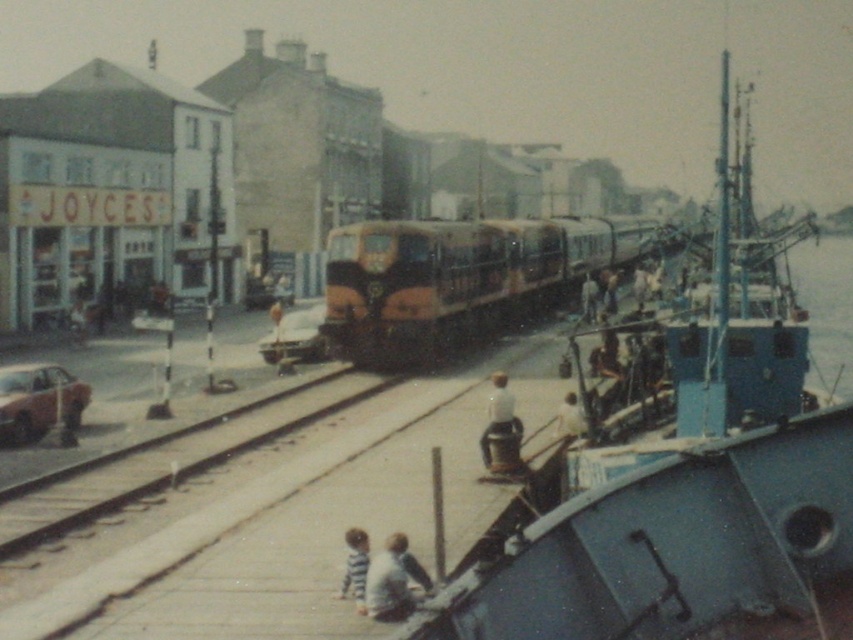
You are a GUI agent. You are given a task and a screenshot of the screen. Output one action in this format:
    pyautogui.click(x=<x>, y=<y>)
    Task: Click on the blue metallic boat at center
    Image resolution: width=853 pixels, height=640 pixels.
    Given the screenshot: What is the action you would take?
    pyautogui.click(x=679, y=484)

Does blue metallic boat at center appear over brown metallic train at center?

Correct, blue metallic boat at center is located above brown metallic train at center.

Identify the location of blue metallic boat at center. The height and width of the screenshot is (640, 853). (679, 484).

Locate an element on the screen. blue metallic boat at center is located at coordinates (679, 484).

Does smooth concrete train track at center come behind light blue fabric shirt at lower center?

Yes, it is.

Who is more forward, [4,545] or [410,589]?

Point [410,589] is in front.

Which is behind, point (79, 518) or point (389, 588)?

The point (79, 518) is behind.

Find the location of a particular element. The width and height of the screenshot is (853, 640). smooth concrete train track at center is located at coordinates (180, 474).

Measure the distance from brown metallic train at center to white fabric shirt at lower center.

brown metallic train at center is 29.73 meters from white fabric shirt at lower center.

The height and width of the screenshot is (640, 853). I want to click on brown metallic train at center, so pyautogui.click(x=456, y=280).

Locate an element on the screen. Image resolution: width=853 pixels, height=640 pixels. brown metallic train at center is located at coordinates pyautogui.click(x=456, y=280).